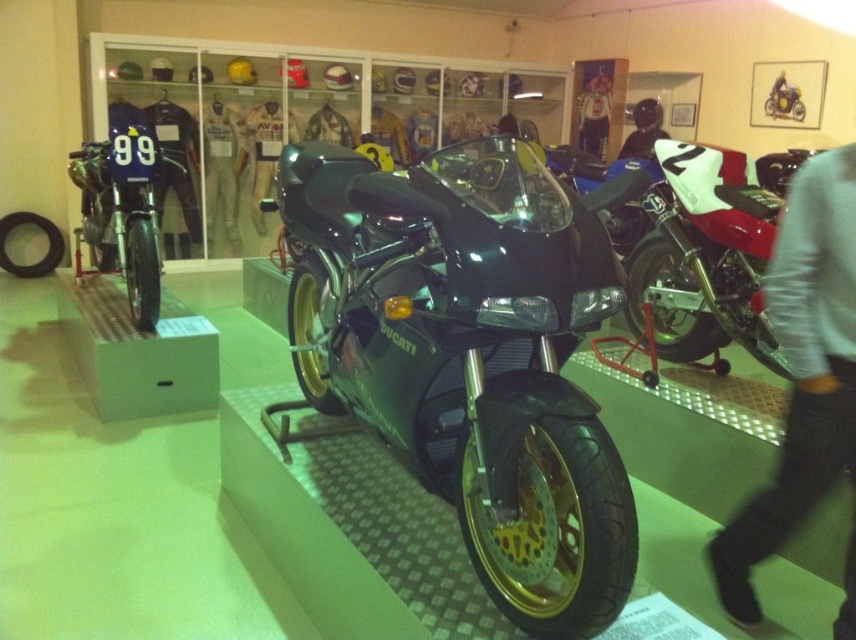
Does black leather helmet at upper center have a smaller size compared to shiny metallic motorcycle at upper right?

No.

Does point (634, 138) come farther from viewer compared to point (764, 113)?

Yes, it is behind point (764, 113).

What do you see at coordinates (643, 129) in the screenshot? I see `black leather helmet at upper center` at bounding box center [643, 129].

Locate an element on the screen. black leather helmet at upper center is located at coordinates (643, 129).

Is gray sweater at upper right taller than shiny metallic racing bike at left?

Yes, gray sweater at upper right is taller than shiny metallic racing bike at left.

Can you confirm if gray sweater at upper right is positioned to the right of shiny metallic racing bike at left?

Indeed, gray sweater at upper right is positioned on the right side of shiny metallic racing bike at left.

Locate an element on the screen. Image resolution: width=856 pixels, height=640 pixels. gray sweater at upper right is located at coordinates (801, 371).

Does point (143, 122) come behind point (639, 128)?

No, (143, 122) is closer to viewer.

Image resolution: width=856 pixels, height=640 pixels. What do you see at coordinates (123, 205) in the screenshot?
I see `shiny metallic racing bike at left` at bounding box center [123, 205].

Is point (72, 152) farther from camera compared to point (649, 145)?

No.

You are a GUI agent. You are given a task and a screenshot of the screen. Output one action in this format:
    pyautogui.click(x=<x>, y=<y>)
    Task: Click on the shiny metallic racing bike at left
    Image resolution: width=856 pixels, height=640 pixels.
    Given the screenshot: What is the action you would take?
    pyautogui.click(x=123, y=205)